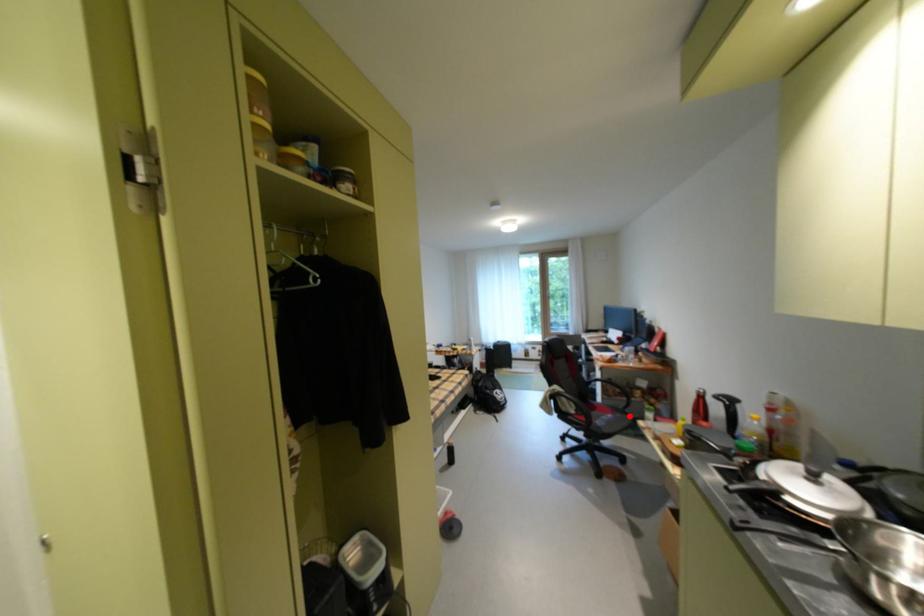
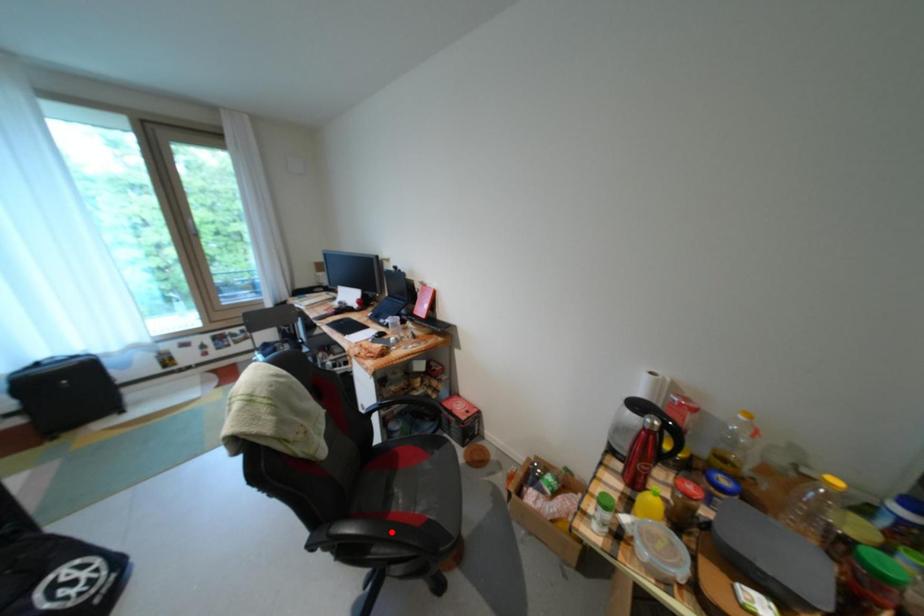
I am providing you with two images of the same scene from different viewpoints. A red point is marked on the first image and another point is marked on the second image. Do the highlighted points in image1 and image2 indicate the same real-world spot?

No